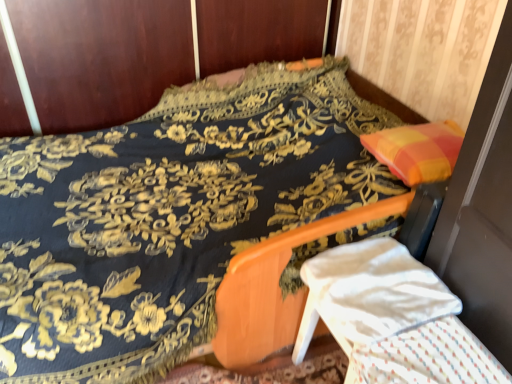
This screenshot has height=384, width=512. Identify the location of vacant space situated above white textured blanket at lower right (from a real-world perspective). (418, 362).